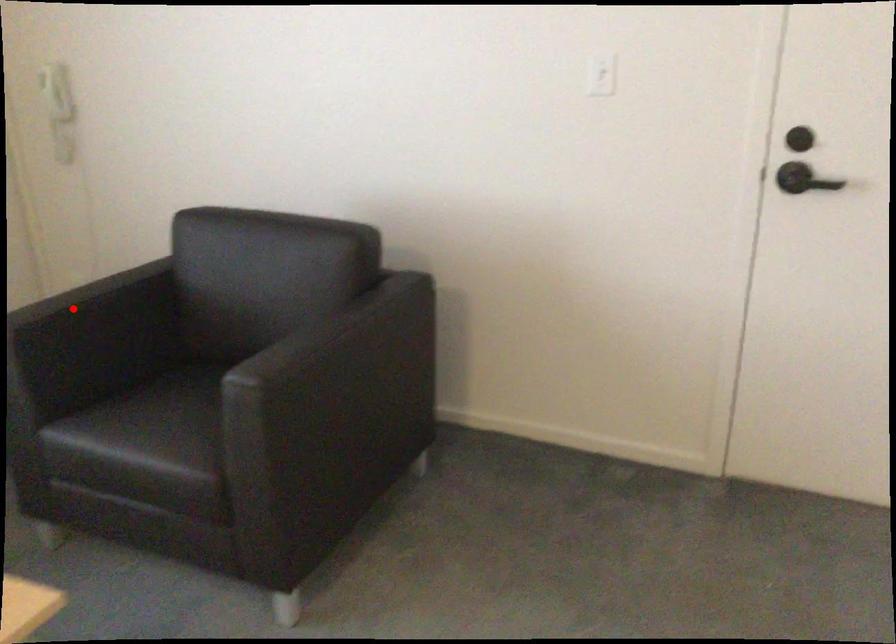
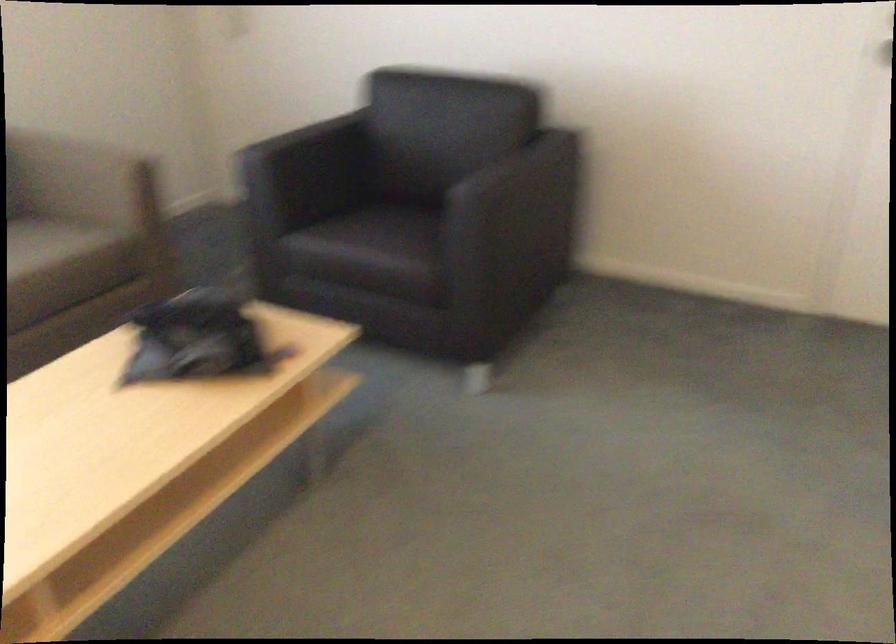
In the second image, find the point that corresponds to the highlighted location in the first image.

(304, 138)